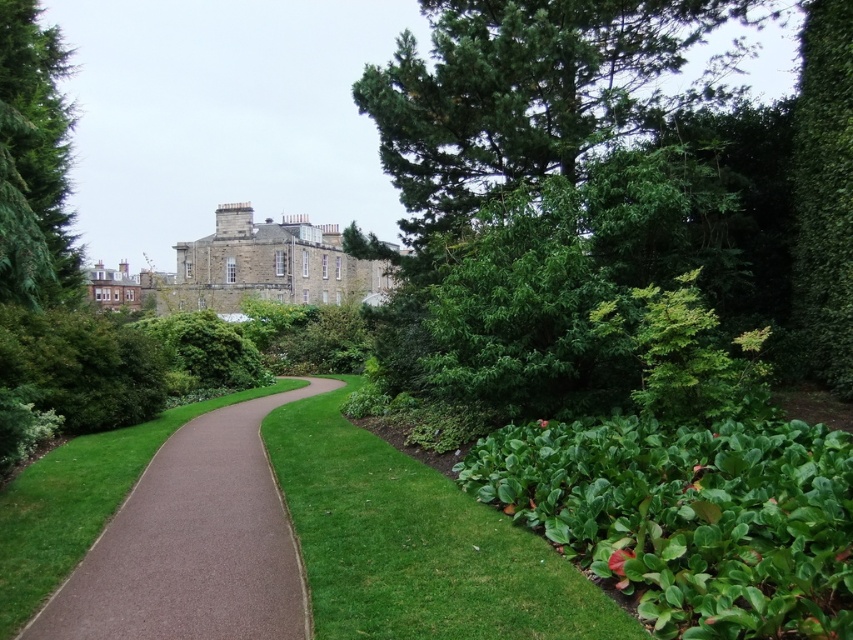
Can you confirm if green leafy tree at upper right is taller than green leafy bush at center-right?

Yes.

How distant is green leafy tree at upper right from green leafy bush at center-right?

green leafy tree at upper right and green leafy bush at center-right are 16.02 feet apart from each other.

Is point (677, 106) less distant than point (766, 326)?

That is False.

Where is `green leafy tree at upper right`? green leafy tree at upper right is located at coordinates 527,99.

Between green leafy tree at upper right and green leafy tree at upper left, which one has more height?

Standing taller between the two is green leafy tree at upper right.

Which is more to the left, green leafy tree at upper right or green leafy tree at upper left?

green leafy tree at upper left

The image size is (853, 640). What do you see at coordinates (527, 99) in the screenshot? I see `green leafy tree at upper right` at bounding box center [527, 99].

Locate an element on the screen. This screenshot has width=853, height=640. green leafy tree at upper right is located at coordinates (527, 99).

Between green leafy grass at lower right and brown textured path at center, which one has less height?

brown textured path at center is shorter.

Is green leafy grass at lower right to the left of brown textured path at center from the viewer's perspective?

In fact, green leafy grass at lower right is to the right of brown textured path at center.

What do you see at coordinates (416, 544) in the screenshot?
I see `green leafy grass at lower right` at bounding box center [416, 544].

Identify the location of green leafy grass at lower right. Image resolution: width=853 pixels, height=640 pixels. (416, 544).